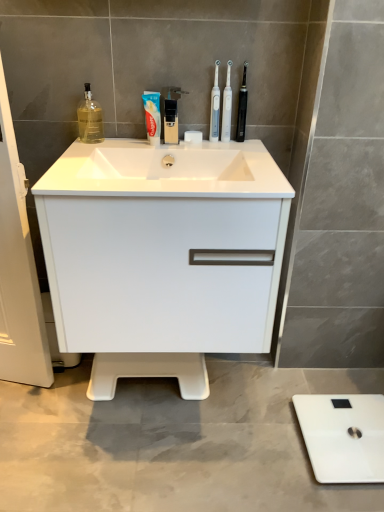
Where is `free space on the front side of clear glass bottle at upper left`? The height and width of the screenshot is (512, 384). free space on the front side of clear glass bottle at upper left is located at coordinates (77, 152).